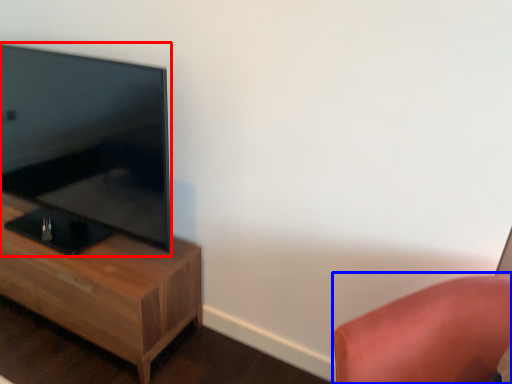
Question: Which of the following is the farthest to the observer, television (highlighted by a red box) or furniture (highlighted by a blue box)?

Choices:
 (A) television
 (B) furniture

Answer: (A)